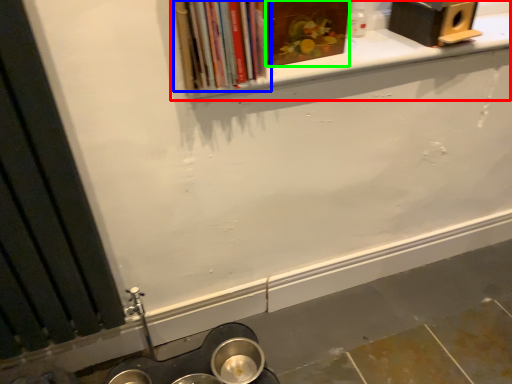
Question: Based on their relative distances, which object is nearer to window sill (highlighted by a red box)? Choose from book (highlighted by a blue box) and book (highlighted by a green box).

Choices:
 (A) book
 (B) book

Answer: (B)